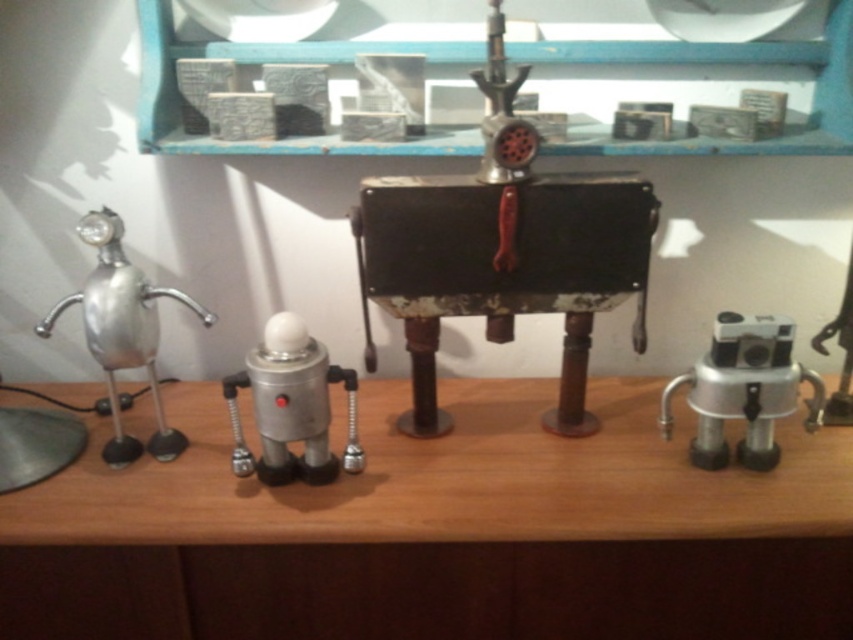
Question: Which point is closer to the camera?

Choices:
 (A) (283, 336)
 (B) (80, 518)
 (C) (155, 301)
 (D) (306, 49)

Answer: (A)

Question: Estimate the real-world distances between objects in this image. Which object is closer to the wooden table at center?

Choices:
 (A) rusty metal meat grinder at center
 (B) metallic silver robot at right

Answer: (B)

Question: Is metallic gray blocks at upper center bigger than brushed metal robot at left?

Choices:
 (A) yes
 (B) no

Answer: (B)

Question: Does metallic silver robot at center have a larger size compared to brushed metal robot at left?

Choices:
 (A) yes
 (B) no

Answer: (B)

Question: Among these objects, which one is nearest to the camera?

Choices:
 (A) metallic silver robot at center
 (B) wooden table at center
 (C) metallic silver robot at right

Answer: (B)

Question: Is wooden table at center wider than metallic silver robot at right?

Choices:
 (A) yes
 (B) no

Answer: (A)